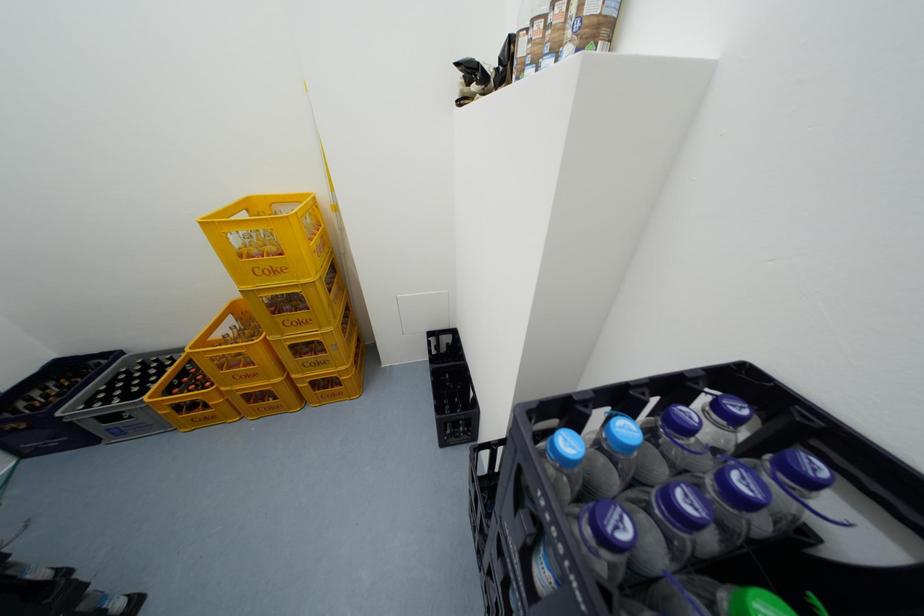
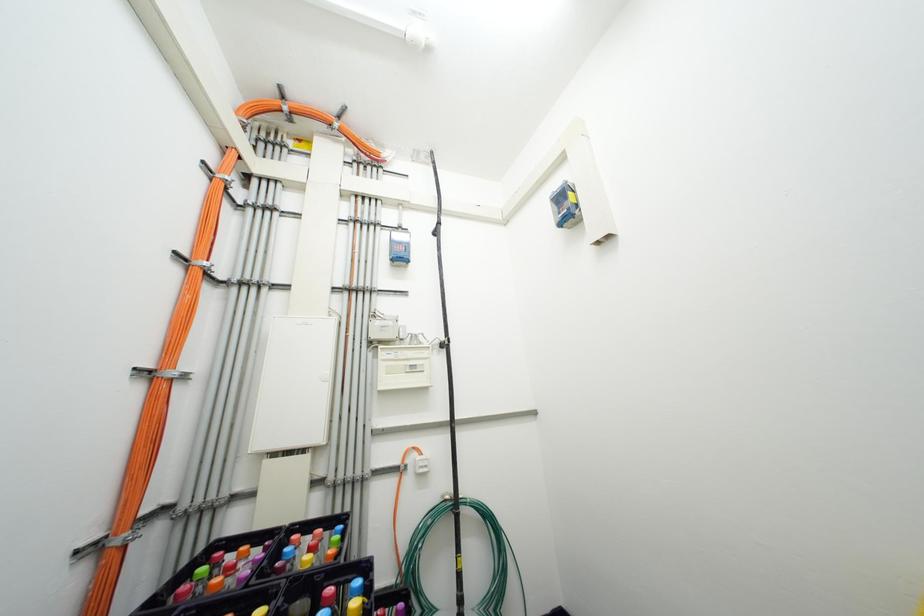
How did the camera likely rotate?

The camera rotated toward left-up.